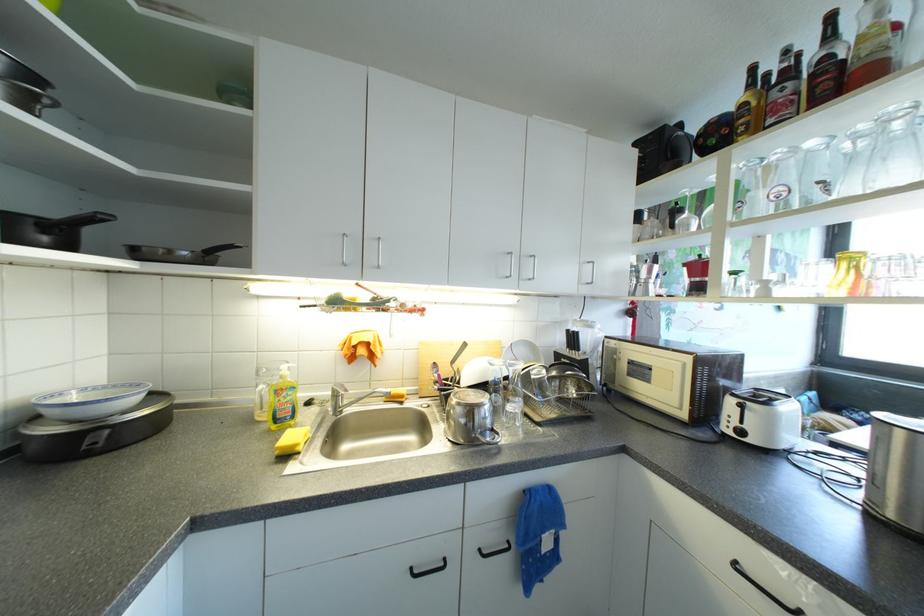
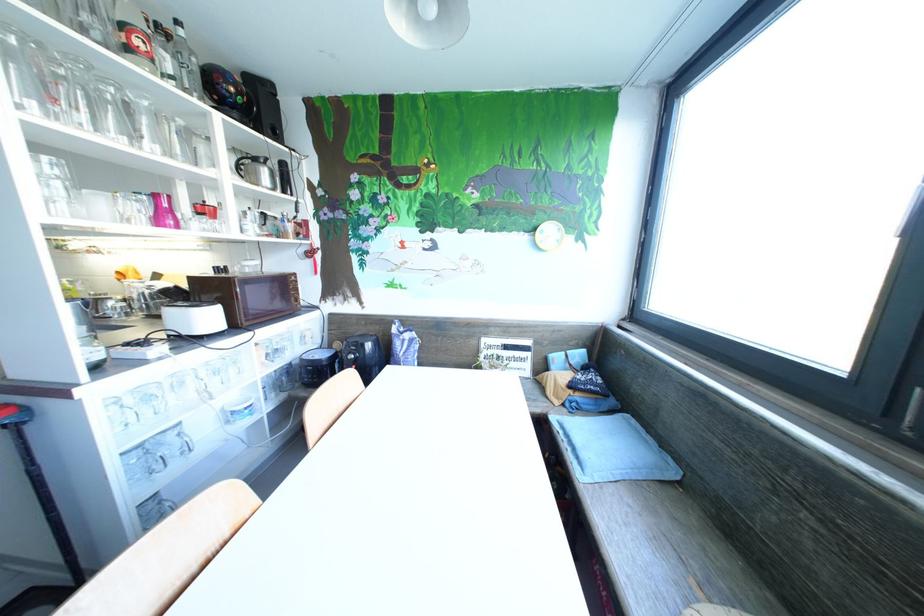
Question: In a continuous first-person perspective shot, in which direction is the camera moving?

Choices:
 (A) Left
 (B) Right
 (C) Forward
 (D) Backward

Answer: (B)